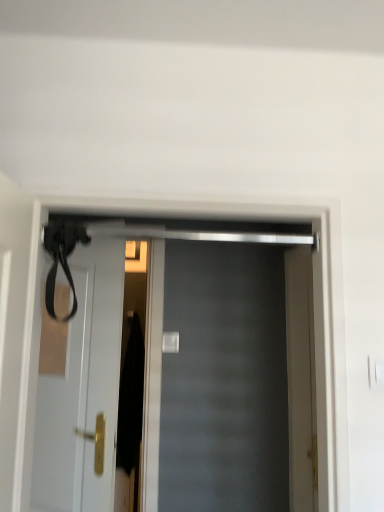
Question: Is white glossy door at upper left, which is the first door in back-to-front order, taller or shorter than matte black door at center, positioned as the 1th door in front-to-back order?

Choices:
 (A) short
 (B) tall

Answer: (B)

Question: Is white glossy door at upper left, the first door from the left, spatially inside matte black door at center, positioned as the 1th door in front-to-back order, or outside of it?

Choices:
 (A) inside
 (B) outside

Answer: (B)

Question: Looking at their shapes, would you say white glossy door at upper left, the first door from the left, is wider or thinner than matte black door at center, the 2th door from the left?

Choices:
 (A) thin
 (B) wide

Answer: (A)

Question: From the image's perspective, relative to white glossy door at upper left, which is the second door in right-to-left order, is matte black door at center, positioned as the 1th door in front-to-back order, above or below?

Choices:
 (A) below
 (B) above

Answer: (B)

Question: Considering the relative positions of matte black door at center, placed as the 2th door when sorted from back to front, and white glossy door at upper left, which appears as the 2th door when viewed from the front, in the image provided, is matte black door at center, placed as the 2th door when sorted from back to front, to the left or to the right of white glossy door at upper left, which appears as the 2th door when viewed from the front,?

Choices:
 (A) left
 (B) right

Answer: (B)

Question: Considering the positions of matte black door at center, placed as the 2th door when sorted from back to front, and white glossy door at upper left, the first door from the left, in the image, is matte black door at center, placed as the 2th door when sorted from back to front, wider or thinner than white glossy door at upper left, the first door from the left,?

Choices:
 (A) wide
 (B) thin

Answer: (A)

Question: In terms of size, does matte black door at center, positioned as the 1th door in front-to-back order, appear bigger or smaller than white glossy door at upper left, which is the first door in back-to-front order?

Choices:
 (A) big
 (B) small

Answer: (A)